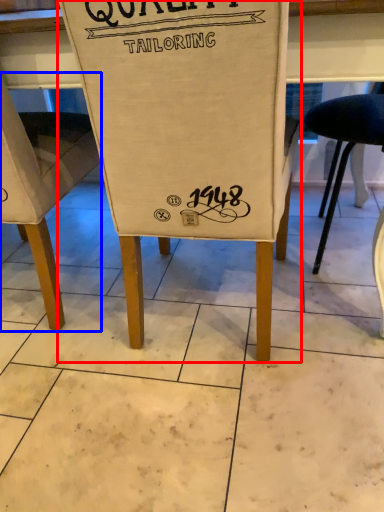
Question: Which object appears closest to the camera in this image, chair (highlighted by a red box) or chair (highlighted by a blue box)?

Choices:
 (A) chair
 (B) chair

Answer: (A)